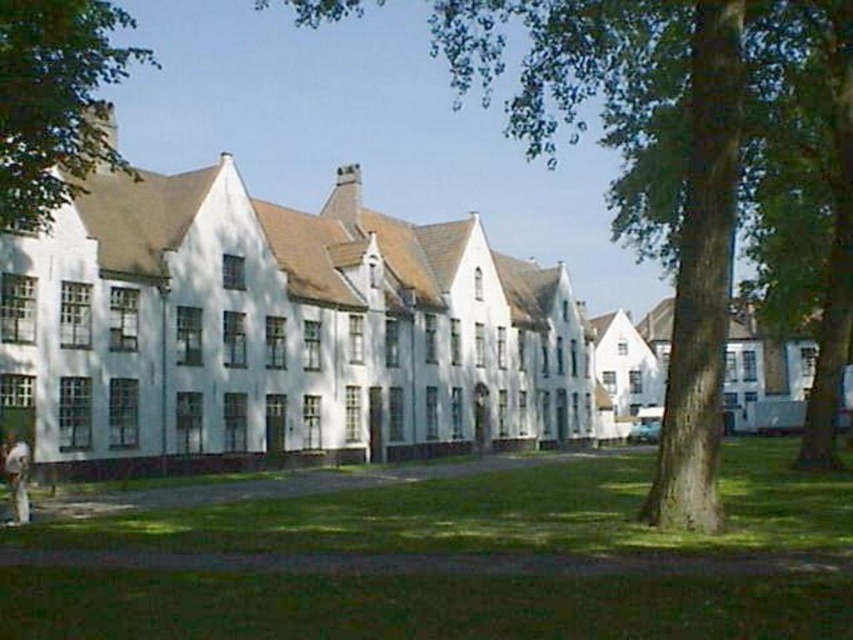
Question: Among these objects, which one is farthest from the camera?

Choices:
 (A) light brown leather jacket at lower left
 (B) green leafy tree at upper left
 (C) green grass at lower center

Answer: (A)

Question: From the image, what is the correct spatial relationship of green grass at lower center in relation to green leafy tree at upper left?

Choices:
 (A) right
 (B) left

Answer: (A)

Question: Which object is the closest to the green leafy tree at upper left?

Choices:
 (A) green grass at lower center
 (B) green textured tree at center
 (C) light brown leather jacket at lower left

Answer: (A)

Question: Can you confirm if green textured tree at center is smaller than green leafy tree at upper left?

Choices:
 (A) yes
 (B) no

Answer: (B)

Question: Can you confirm if green textured tree at center is positioned to the right of green leafy tree at upper left?

Choices:
 (A) no
 (B) yes

Answer: (B)

Question: Which point is closer to the camera?

Choices:
 (A) (814, 593)
 (B) (689, 344)
 (C) (6, 444)

Answer: (A)